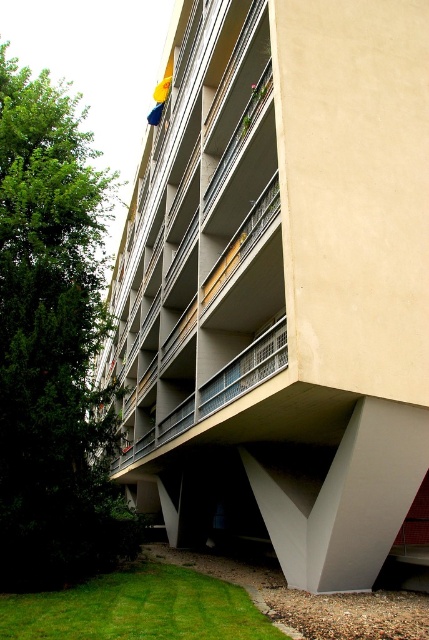
Question: Which point is closer to the camera taking this photo?

Choices:
 (A) (100, 524)
 (B) (148, 636)

Answer: (B)

Question: Does green leafy tree at left have a larger size compared to green grass at lower left?

Choices:
 (A) no
 (B) yes

Answer: (B)

Question: Considering the relative positions of green leafy tree at left and green grass at lower left in the image provided, where is green leafy tree at left located with respect to green grass at lower left?

Choices:
 (A) right
 (B) left

Answer: (B)

Question: Which of the following is the closest to the observer?

Choices:
 (A) (138, 616)
 (B) (88, 240)

Answer: (A)

Question: Is green leafy tree at left in front of green grass at lower left?

Choices:
 (A) yes
 (B) no

Answer: (B)